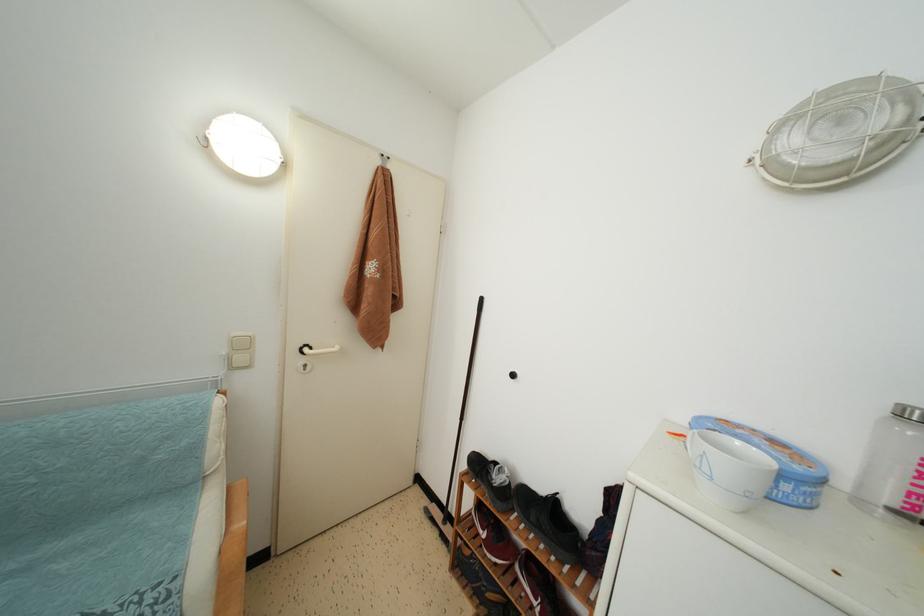
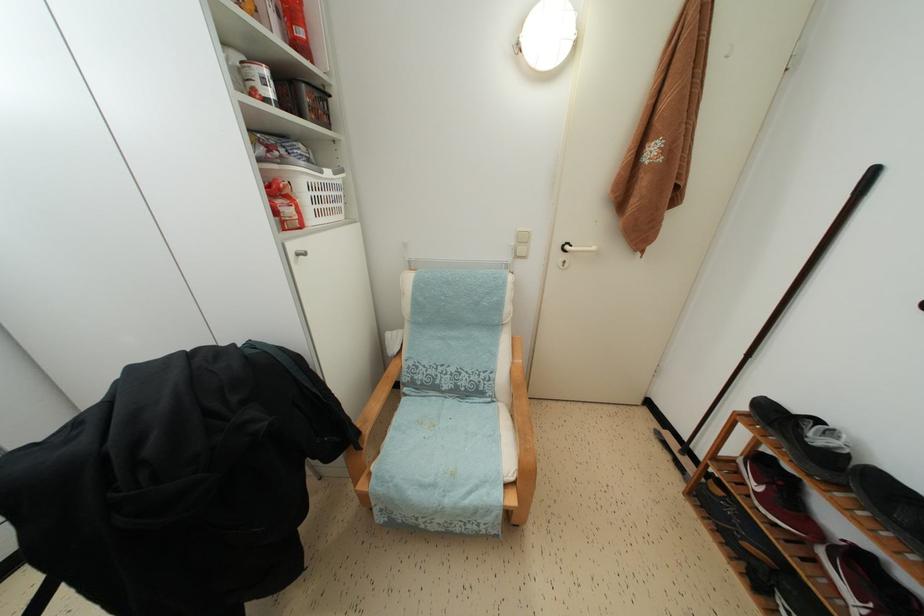
Where in the second image is the point corresponding to point (247, 351) from the first image?

(527, 245)